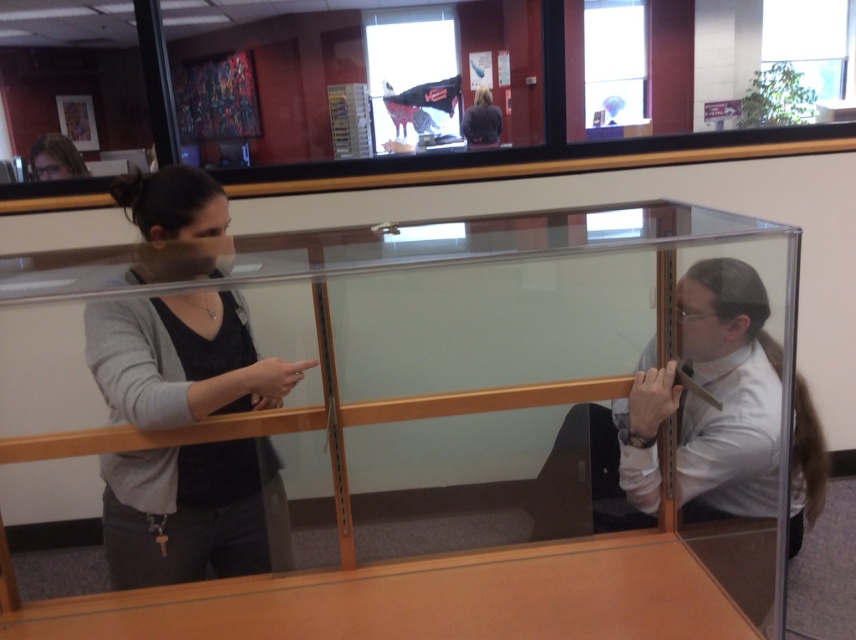
You are an interior designer assessing the space between two people separated by a glass partition. The dark gray sweater at left and the white glossy shirt at right are visible. Which person has a narrower body width?

The dark gray sweater at left has a narrower body width than the white glossy shirt at right because the dark gray sweater at left is less wide than the white glossy shirt at right.

You are standing in an office and see two people separated by a glass partition. One person is pointing at the point marked by the coordinates point (x=193, y=513). Who is pointing at that point?

The dark gray sweater at left is represented by point (x=193, y=513), so the person on the left is pointing at that point.

You are a delivery person who needs to place a package on the light brown wood table at center. You are currently standing at the position of the matte black hair at upper left. Can you reach the table without moving from your current spot?

The light brown wood table at center is 3.82 meters away from matte black hair at upper left. Since the distance is greater than an average person can reach, you cannot place the package on the light brown wood table at center without moving from your current spot.